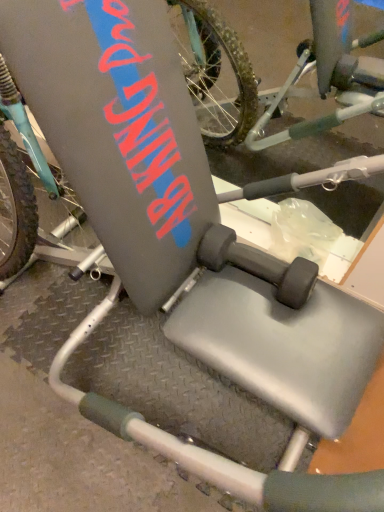
Where is `matte gray bicycle at center`? matte gray bicycle at center is located at coordinates (26, 185).

What do you see at coordinates (26, 185) in the screenshot? I see `matte gray bicycle at center` at bounding box center [26, 185].

Based on the photo, what is the approximate height of matte gray bicycle at center?

matte gray bicycle at center is 35.34 inches tall.

This screenshot has height=512, width=384. I want to click on matte gray bicycle at center, so click(26, 185).